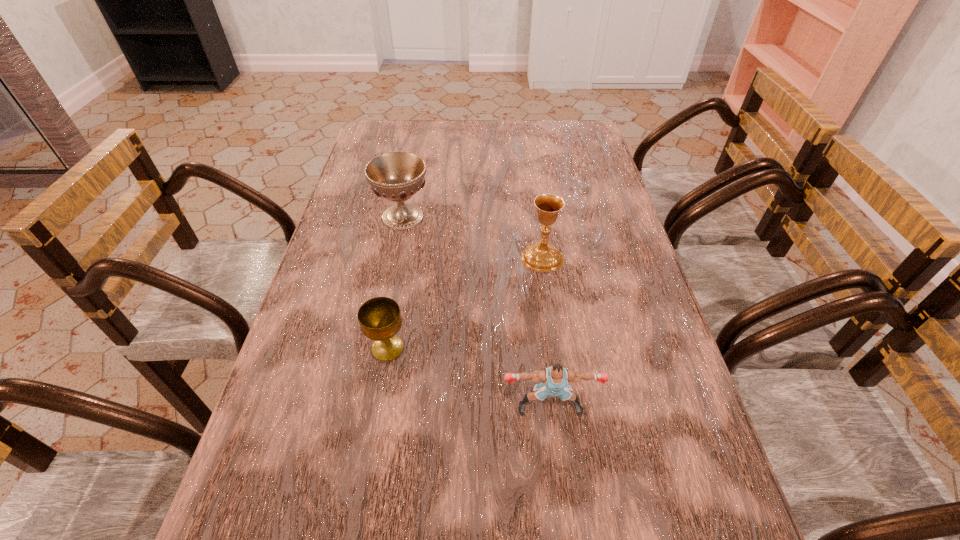
Where is `vacant space that satisfies the following two spatial constraints: 1. on the back side of the nearest chalice; 2. on the right side of the second nearest chalice`? The height and width of the screenshot is (540, 960). vacant space that satisfies the following two spatial constraints: 1. on the back side of the nearest chalice; 2. on the right side of the second nearest chalice is located at coordinates (404, 257).